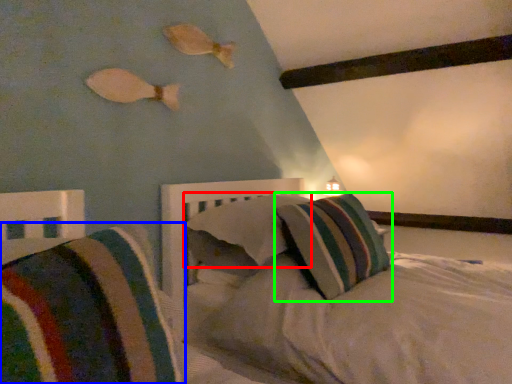
Question: Which object is positioned farthest from pillow (highlighted by a red box)? Select from pillow (highlighted by a blue box) and pillow (highlighted by a green box).

Choices:
 (A) pillow
 (B) pillow

Answer: (A)